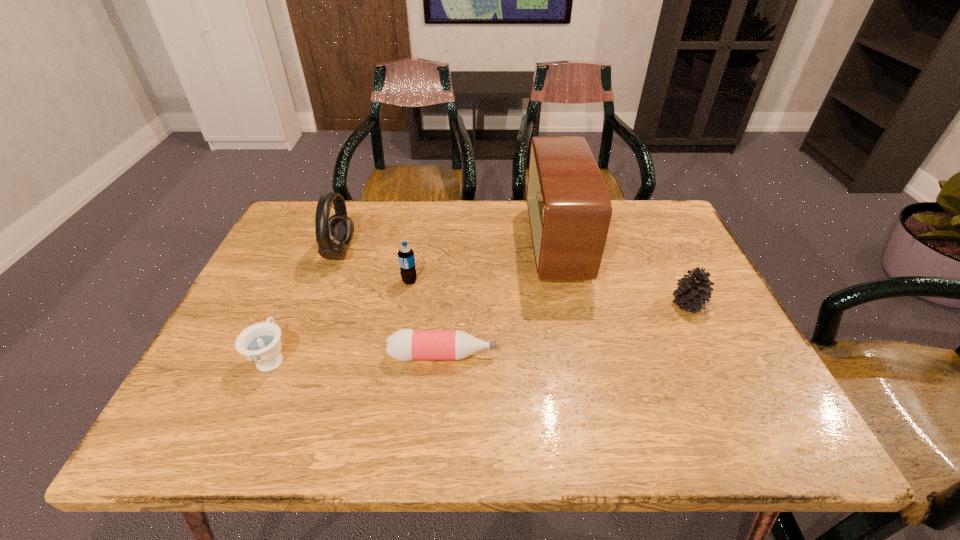
Find the location of `headset located at the left edge`. headset located at the left edge is located at coordinates (333, 234).

You are a GUI agent. You are given a task and a screenshot of the screen. Output one action in this format:
    pyautogui.click(x=<x>, y=<y>)
    Task: Click on the teacup positioned at the left edge
    Image resolution: width=960 pixels, height=540 pixels.
    Given the screenshot: What is the action you would take?
    pyautogui.click(x=260, y=343)

You are a GUI agent. You are given a task and a screenshot of the screen. Output one action in this format:
    pyautogui.click(x=<x>, y=<y>)
    Task: Click on the object that is at the right edge
    This screenshot has width=960, height=540.
    Given the screenshot: What is the action you would take?
    pyautogui.click(x=693, y=292)

The height and width of the screenshot is (540, 960). Identify the location of object at the far left corner. (333, 234).

In the image, there is a desktop. Identify the location of free space at the far edge. This screenshot has height=540, width=960. (391, 207).

At what (x,y) coordinates should I click in order to perform the action: click on free space at the near edge. Please return your answer as a coordinate pair (x, y). The image size is (960, 540). Looking at the image, I should click on (607, 427).

What are the coordinates of `vacant area at the left edge` in the screenshot? It's located at (274, 260).

You are a GUI agent. You are given a task and a screenshot of the screen. Output one action in this format:
    pyautogui.click(x=<x>, y=<y>)
    Task: Click on the free region at the right edge of the desktop
    The width and height of the screenshot is (960, 540).
    Given the screenshot: What is the action you would take?
    pyautogui.click(x=647, y=251)

In the image, there is a desktop. Find the location of `vacant space at the far left corner`. vacant space at the far left corner is located at coordinates (274, 246).

You are a GUI agent. You are given a task and a screenshot of the screen. Output one action in this format:
    pyautogui.click(x=<x>, y=<y>)
    Task: Click on the free space at the near left corner of the desktop
    The image size is (960, 540).
    Given the screenshot: What is the action you would take?
    pyautogui.click(x=249, y=437)